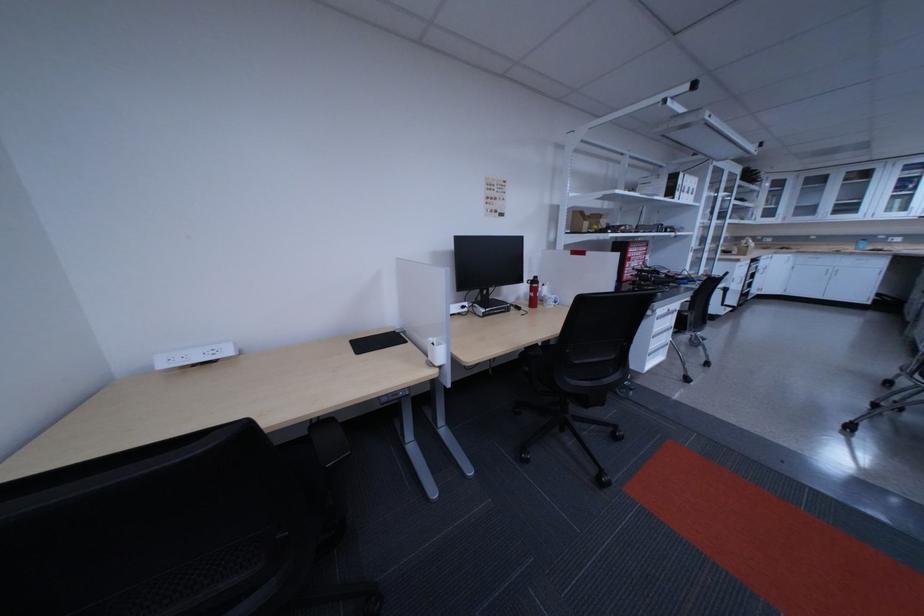
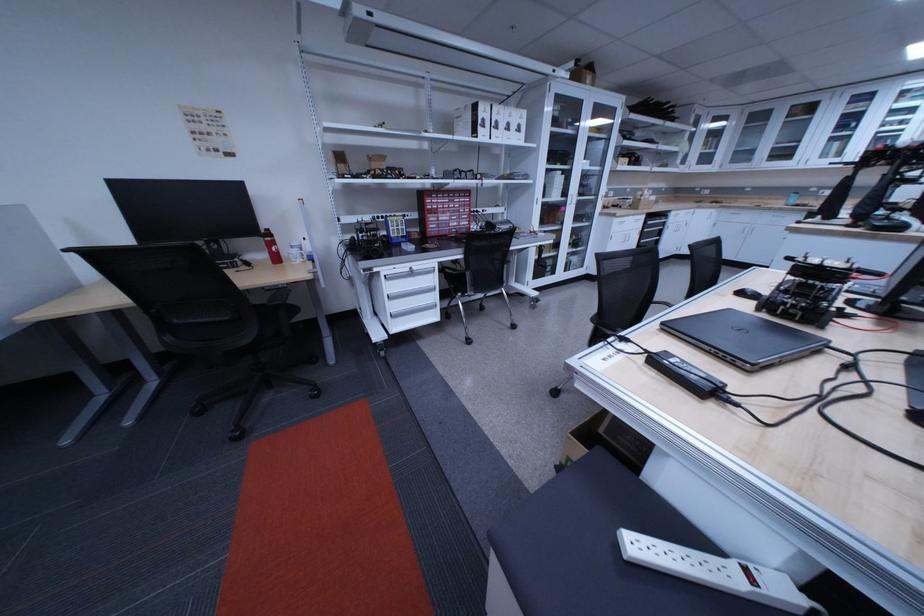
Find the pixel in the second image that matches point 861,262 in the first image.

(779, 220)